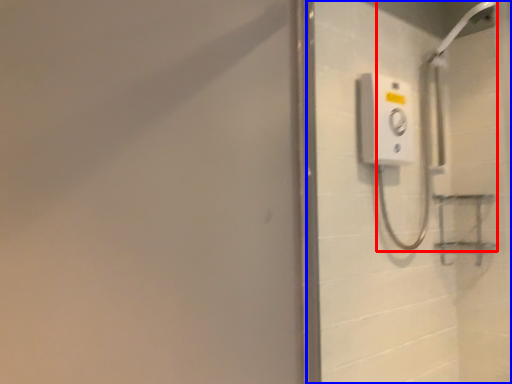
Question: Which of the following is the closest to the observer, shower (highlighted by a red box) or screen door (highlighted by a blue box)?

Choices:
 (A) shower
 (B) screen door

Answer: (B)